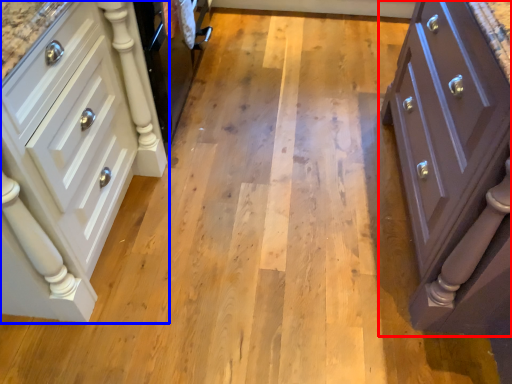
Question: Which of the following is the closest to the observer, chest of drawers (highlighted by a red box) or chest of drawers (highlighted by a blue box)?

Choices:
 (A) chest of drawers
 (B) chest of drawers

Answer: (A)